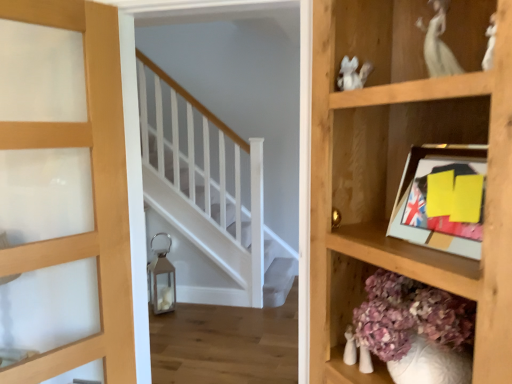
Question: Is matte wood door at left facing towards yellow paper picture frame at upper right?

Choices:
 (A) no
 (B) yes

Answer: (A)

Question: From a real-world perspective, does matte wood door at left stand above yellow paper picture frame at upper right?

Choices:
 (A) no
 (B) yes

Answer: (A)

Question: Can you confirm if matte wood door at left is bigger than yellow paper picture frame at upper right?

Choices:
 (A) yes
 (B) no

Answer: (A)

Question: Is matte wood door at left in front of yellow paper picture frame at upper right?

Choices:
 (A) yes
 (B) no

Answer: (B)

Question: From the image's perspective, would you say matte wood door at left is positioned over yellow paper picture frame at upper right?

Choices:
 (A) yes
 (B) no

Answer: (B)

Question: Is point (451, 142) positioned closer to the camera than point (452, 150)?

Choices:
 (A) farther
 (B) closer

Answer: (A)

Question: Is wooden shelf at right taller or shorter than yellow paper picture frame at upper right?

Choices:
 (A) short
 (B) tall

Answer: (B)

Question: From the image's perspective, is wooden shelf at right positioned above or below yellow paper picture frame at upper right?

Choices:
 (A) below
 (B) above

Answer: (A)

Question: Visually, is wooden shelf at right positioned to the left or to the right of yellow paper picture frame at upper right?

Choices:
 (A) right
 (B) left

Answer: (A)

Question: Is matte wood door at left to the left or to the right of wooden shelf at right in the image?

Choices:
 (A) left
 (B) right

Answer: (A)

Question: From their relative heights in the image, would you say matte wood door at left is taller or shorter than wooden shelf at right?

Choices:
 (A) tall
 (B) short

Answer: (A)

Question: Based on their sizes in the image, would you say matte wood door at left is bigger or smaller than wooden shelf at right?

Choices:
 (A) small
 (B) big

Answer: (A)

Question: From a real-world perspective, is matte wood door at left above or below wooden shelf at right?

Choices:
 (A) below
 (B) above

Answer: (A)

Question: From a real-world perspective, is yellow paper picture frame at upper right physically located above or below matte wood door at left?

Choices:
 (A) below
 (B) above

Answer: (B)

Question: Looking at their shapes, would you say yellow paper picture frame at upper right is wider or thinner than matte wood door at left?

Choices:
 (A) wide
 (B) thin

Answer: (B)